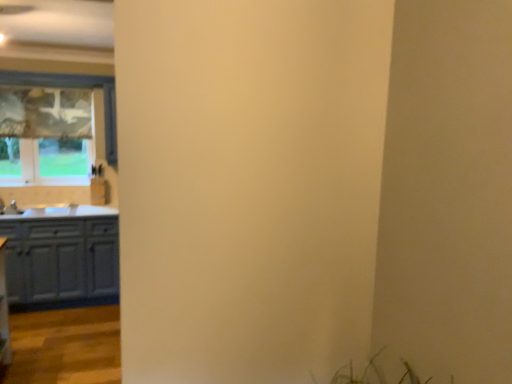
What do you see at coordinates (52, 127) in the screenshot? I see `matte glass window at left` at bounding box center [52, 127].

Measure the distance between matte glass window at left and camera.

matte glass window at left is 4.07 meters from camera.

Identify the location of matte glass window at left. The image size is (512, 384). (52, 127).

The height and width of the screenshot is (384, 512). I want to click on matte white cabinets at left, so click(x=61, y=257).

Describe the element at coordinates (61, 257) in the screenshot. I see `matte white cabinets at left` at that location.

From the picture: What is the approximate height of matte white cabinets at left?

It is 35.33 inches.

In order to face matte white cabinets at left, should I rotate leftwards or rightwards?

Rotate left and turn 24.857 degrees.

In order to click on matte glass window at left in this screenshot , I will do `click(52, 127)`.

Between matte glass window at left and matte white cabinets at left, which one appears on the left side from the viewer's perspective?

From the viewer's perspective, matte glass window at left appears more on the left side.

Considering the positions of objects matte glass window at left and matte white cabinets at left in the image provided, who is in front, matte glass window at left or matte white cabinets at left?

matte white cabinets at left.

Between point (7, 142) and point (71, 251), which one is positioned behind?

The point (7, 142) is farther from the camera.

From the image's perspective, which is below, matte glass window at left or matte white cabinets at left?

matte white cabinets at left, from the image's perspective.

From a real-world perspective, who is located higher, matte glass window at left or matte white cabinets at left?

matte glass window at left.

Is matte glass window at left wider or thinner than matte white cabinets at left?

Clearly, matte glass window at left has less width compared to matte white cabinets at left.

Is matte glass window at left taller than matte white cabinets at left?

Indeed, matte glass window at left has a greater height compared to matte white cabinets at left.

Is matte glass window at left bigger than matte white cabinets at left?

Incorrect, matte glass window at left is not larger than matte white cabinets at left.

Is matte glass window at left spatially inside matte white cabinets at left, or outside of it?

The correct answer is: outside.

Is matte glass window at left far away from matte white cabinets at left?

That's not correct — matte glass window at left is a little close to matte white cabinets at left.

Is matte glass window at left turned away from matte white cabinets at left?

No, matte white cabinets at left is not at the back of matte glass window at left.

How different are the orientations of matte glass window at left and matte white cabinets at left in degrees?

There is a 0.00436-degree angle between the facing directions of matte glass window at left and matte white cabinets at left.

Measure the distance between matte glass window at left and matte white cabinets at left.

37.92 inches.

You are a GUI agent. You are given a task and a screenshot of the screen. Output one action in this format:
    pyautogui.click(x=<x>, y=<y>)
    Task: Click on the window that appears on the left of matte white cabinets at left
    
    Given the screenshot: What is the action you would take?
    pyautogui.click(x=52, y=127)

Which object is positioned more to the right, matte white cabinets at left or matte glass window at left?

Positioned to the right is matte white cabinets at left.

Looking at this image, is matte white cabinets at left closer to camera compared to matte glass window at left?

Yes, it is.

Is point (33, 215) positioned behind point (106, 86)?

No.

From the image's perspective, which object appears higher, matte white cabinets at left or matte glass window at left?

matte glass window at left appears higher in the image.

From a real-world perspective, is matte white cabinets at left over matte glass window at left?

No, from a real-world perspective, matte white cabinets at left is not on top of matte glass window at left.

Considering the sizes of matte white cabinets at left and matte glass window at left in the image, is matte white cabinets at left wider or thinner than matte glass window at left?

Considering their sizes, matte white cabinets at left looks broader than matte glass window at left.

Which of these two, matte white cabinets at left or matte glass window at left, stands taller?

With more height is matte glass window at left.

Is matte white cabinets at left bigger or smaller than matte glass window at left?

Considering their sizes, matte white cabinets at left takes up more space than matte glass window at left.

Would you say matte white cabinets at left contains matte glass window at left?

No, matte glass window at left is not surrounded by matte white cabinets at left.

Is the surface of matte white cabinets at left in direct contact with matte glass window at left?

matte white cabinets at left is not next to matte glass window at left, and they're not touching.

Is matte white cabinets at left looking in the opposite direction of matte glass window at left?

matte white cabinets at left does not have its back to matte glass window at left.

What's the angular difference between matte white cabinets at left and matte glass window at left's facing directions?

The facing directions of matte white cabinets at left and matte glass window at left are 0.00436 degrees apart.

Find the location of `window on the left of the matte white cabinets at left`. window on the left of the matte white cabinets at left is located at coordinates (52, 127).

The width and height of the screenshot is (512, 384). What are the coordinates of `window that appears above the matte white cabinets at left (from a real-world perspective)` in the screenshot? It's located at pos(52,127).

Image resolution: width=512 pixels, height=384 pixels. In order to click on cabinetry lying in front of the matte glass window at left in this screenshot , I will do `click(61, 257)`.